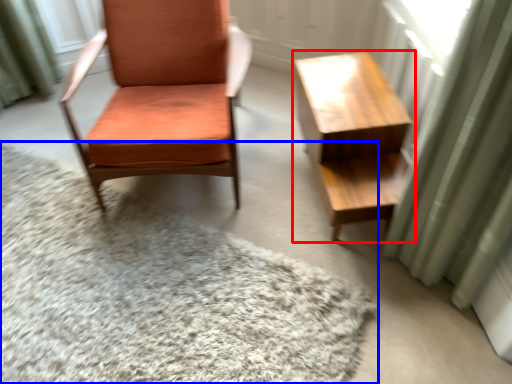
Question: Which object is closer to the camera taking this photo, table (highlighted by a red box) or mat (highlighted by a blue box)?

Choices:
 (A) table
 (B) mat

Answer: (B)